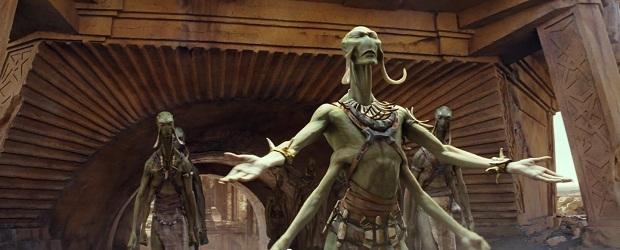
The image size is (620, 250). What are the coordinates of `ridged decorative brown wall` in the screenshot? It's located at (100, 84), (471, 95).